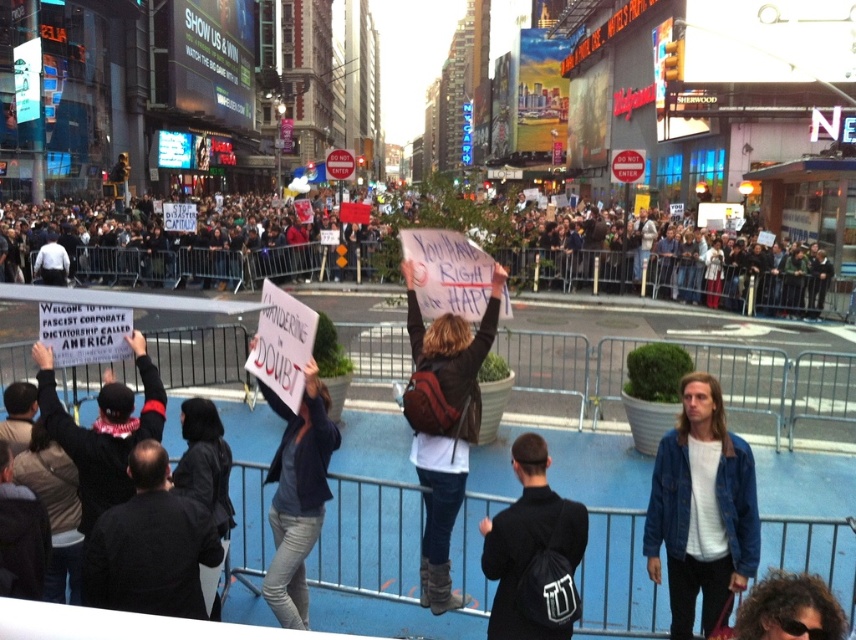
Based on the scene description, what is the 2D coordinate of the dark gray concrete crowd at upper center?

The dark gray concrete crowd at upper center is located at the 2D coordinate point of (218, 259).

You are a photographer trying to capture a protest scene. You have a camera with a wide angle lens that can capture large groups but struggles with small details. You see the dark gray concrete crowd at upper center and the curly hair at lower right. Which subject would be better suited for your current camera setup?

The dark gray concrete crowd at upper center is larger in size than curly hair at lower right, so it would be better suited for your camera setup since it can handle large groups better.

You are a photographer standing in the public square. You want to take a photo of the denim jacket at lower right and the dark blue jacket at center. Which jacket will appear larger in your photo?

The dark blue jacket at center will appear larger in the photo because it is larger than the denim jacket at lower right.